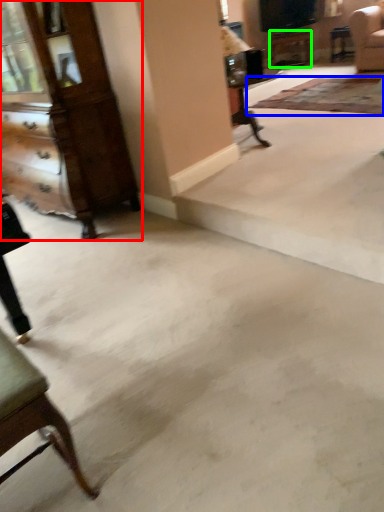
Question: Which object is the farthest from dresser (highlighted by a red box)? Choose among these: mat (highlighted by a blue box) or table (highlighted by a green box).

Choices:
 (A) mat
 (B) table

Answer: (B)